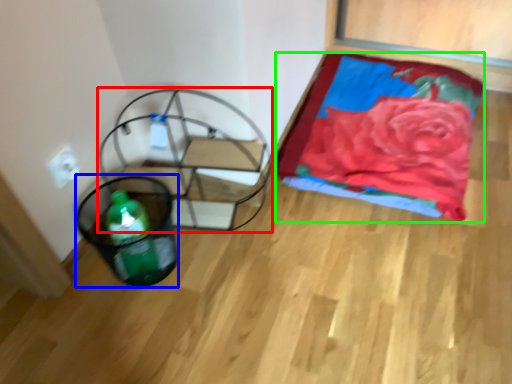
Question: Which object is the farthest from swivel chair (highlighted by a red box)? Choose among these: basket (highlighted by a blue box) or blanket (highlighted by a green box).

Choices:
 (A) basket
 (B) blanket

Answer: (B)